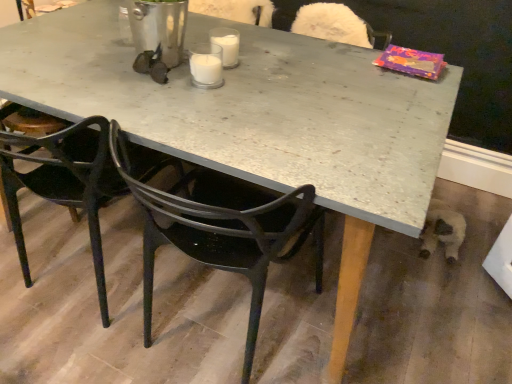
Question: Considering the relative sizes of white glass at center, the 1th coffee cup in the back-to-front sequence, and white glass candle at center, which is the first coffee cup in front-to-back order, in the image provided, is white glass at center, the 1th coffee cup in the back-to-front sequence, bigger than white glass candle at center, which is the first coffee cup in front-to-back order,?

Choices:
 (A) no
 (B) yes

Answer: (A)

Question: Can you confirm if white glass at center, the 1th coffee cup in the back-to-front sequence, is taller than white glass candle at center, which is the first coffee cup in front-to-back order?

Choices:
 (A) yes
 (B) no

Answer: (B)

Question: From the image's perspective, would you say white glass at center, the 2th coffee cup in the front-to-back sequence, is shown under white glass candle at center, which is the first coffee cup in front-to-back order?

Choices:
 (A) no
 (B) yes

Answer: (A)

Question: Is white glass at center, the 1th coffee cup in the back-to-front sequence, next to white glass candle at center, the second coffee cup positioned from the back, and touching it?

Choices:
 (A) yes
 (B) no

Answer: (A)

Question: From the image's perspective, is white glass at center, the 1th coffee cup in the back-to-front sequence, over white glass candle at center, the second coffee cup positioned from the back?

Choices:
 (A) no
 (B) yes

Answer: (B)

Question: Does white glass at center, the 2th coffee cup in the front-to-back sequence, have a greater width compared to white glass candle at center, the second coffee cup positioned from the back?

Choices:
 (A) no
 (B) yes

Answer: (B)

Question: Can you confirm if matte black chair at lower left, arranged as the 1th chair when viewed from the left, is smaller than black plastic chair at center, which is counted as the 1th chair, starting from the right?

Choices:
 (A) yes
 (B) no

Answer: (B)

Question: Considering the relative sizes of matte black chair at lower left, arranged as the 1th chair when viewed from the left, and black plastic chair at center, which ranks as the 2th chair in left-to-right order, in the image provided, is matte black chair at lower left, arranged as the 1th chair when viewed from the left, taller than black plastic chair at center, which ranks as the 2th chair in left-to-right order,?

Choices:
 (A) no
 (B) yes

Answer: (A)

Question: Would you say matte black chair at lower left, marked as the 2th chair in a right-to-left arrangement, is outside black plastic chair at center, which is counted as the 1th chair, starting from the right?

Choices:
 (A) yes
 (B) no

Answer: (A)

Question: Is black plastic chair at center, which is counted as the 1th chair, starting from the right, at the back of matte black chair at lower left, marked as the 2th chair in a right-to-left arrangement?

Choices:
 (A) no
 (B) yes

Answer: (A)

Question: From the image's perspective, is matte black chair at lower left, arranged as the 1th chair when viewed from the left, under black plastic chair at center, which is counted as the 1th chair, starting from the right?

Choices:
 (A) no
 (B) yes

Answer: (A)

Question: From the image's perspective, is matte black chair at lower left, arranged as the 1th chair when viewed from the left, over black plastic chair at center, which is counted as the 1th chair, starting from the right?

Choices:
 (A) no
 (B) yes

Answer: (B)

Question: Can you confirm if white glass candle at center, the second coffee cup positioned from the back, is positioned to the left of black plastic chair at center, which ranks as the 2th chair in left-to-right order?

Choices:
 (A) yes
 (B) no

Answer: (A)